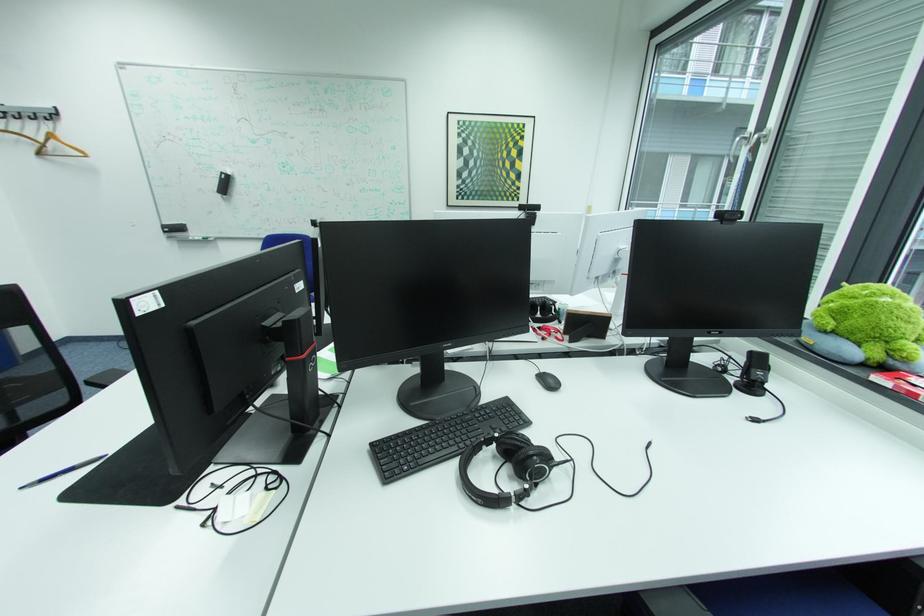
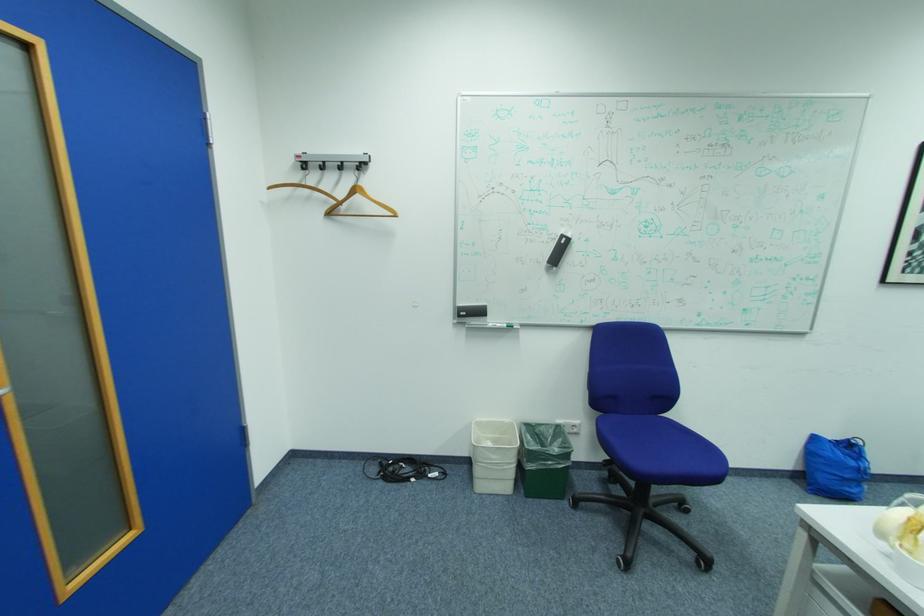
In the second image, find the point that corresponds to (49,153) in the first image.

(337, 214)